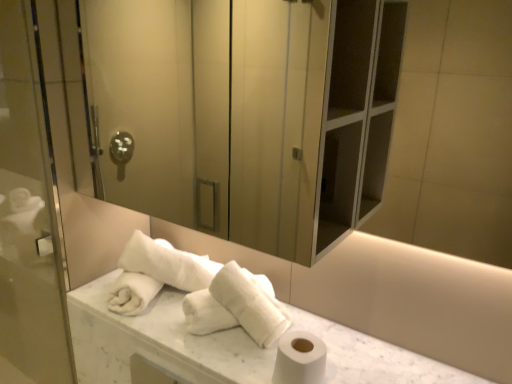
Identify the location of free location to the right of white matte toilet paper at lower right. This screenshot has width=512, height=384. (360, 362).